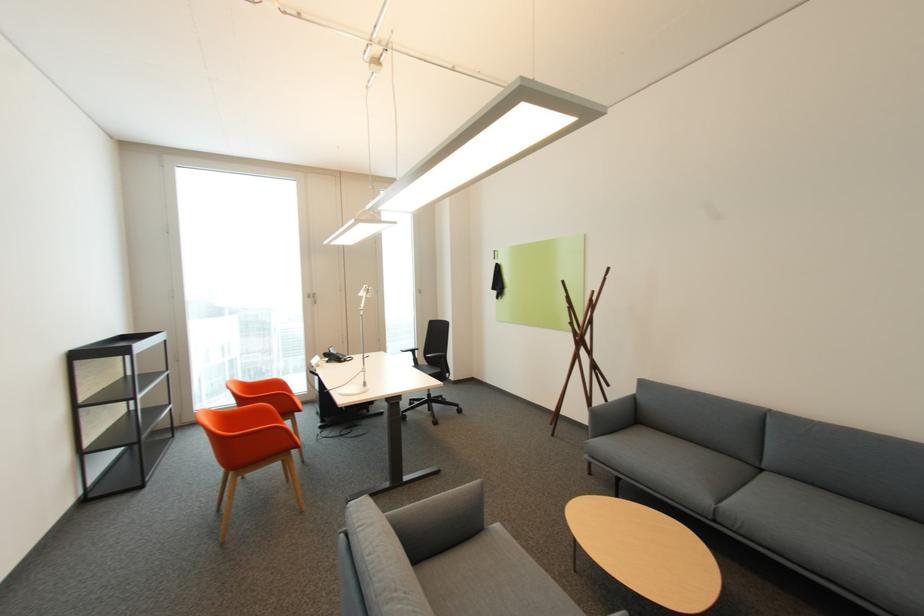
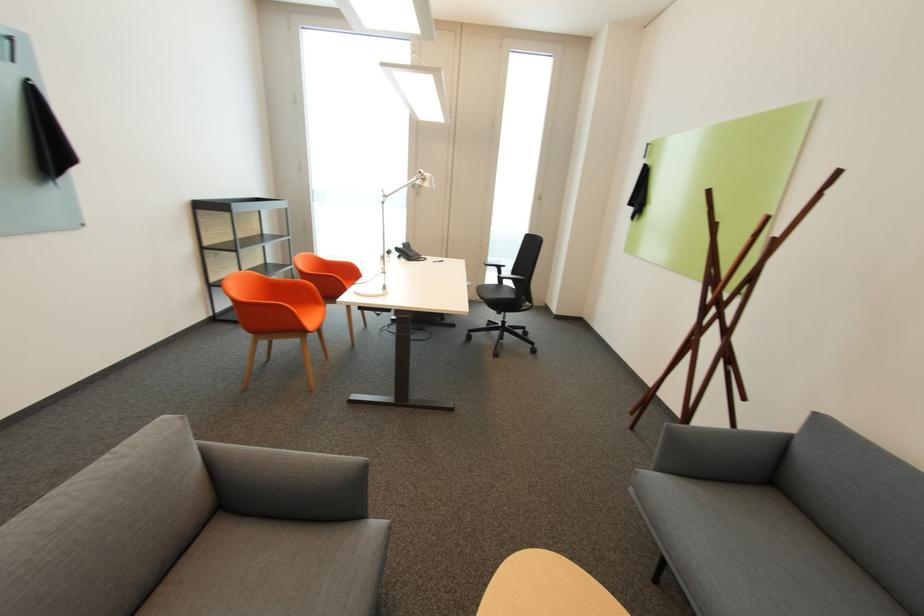
Where in the second image is the point corresponding to [600,439] from the first image?

(663, 469)